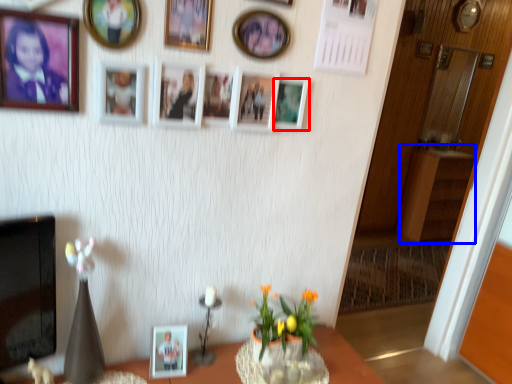
Question: Which object appears closest to the camera in this image, picture frame (highlighted by a red box) or dresser (highlighted by a blue box)?

Choices:
 (A) picture frame
 (B) dresser

Answer: (A)